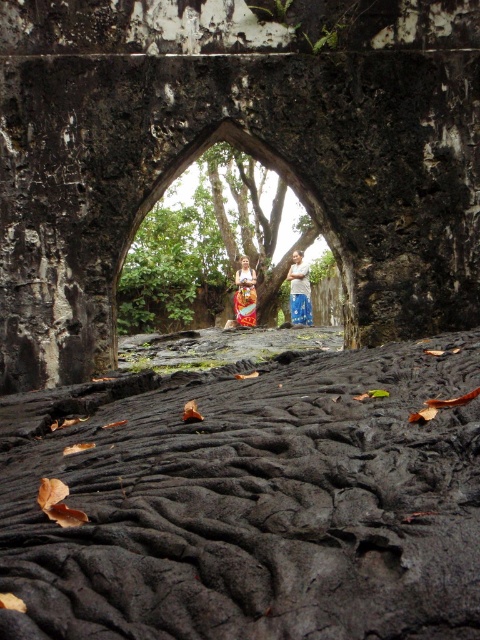
Question: Does blue denim jeans at center have a smaller size compared to orange fabric skirt at center?

Choices:
 (A) yes
 (B) no

Answer: (A)

Question: Considering the relative positions of black textured rock at lower center and orange fabric skirt at center in the image provided, where is black textured rock at lower center located with respect to orange fabric skirt at center?

Choices:
 (A) above
 (B) below

Answer: (B)

Question: Is black textured rock at lower center bigger than green leafy tree at center?

Choices:
 (A) no
 (B) yes

Answer: (A)

Question: Based on their relative distances, which object is farther from the green leafy tree at center?

Choices:
 (A) black textured rock at lower center
 (B) orange fabric skirt at center
 (C) blue denim jeans at center

Answer: (A)

Question: Among these points, which one is farthest from the camera?

Choices:
 (A) (37, 472)
 (B) (238, 282)
 (C) (309, 269)

Answer: (B)

Question: Which point appears farthest from the camera in this image?

Choices:
 (A) (192, 273)
 (B) (419, 627)

Answer: (A)